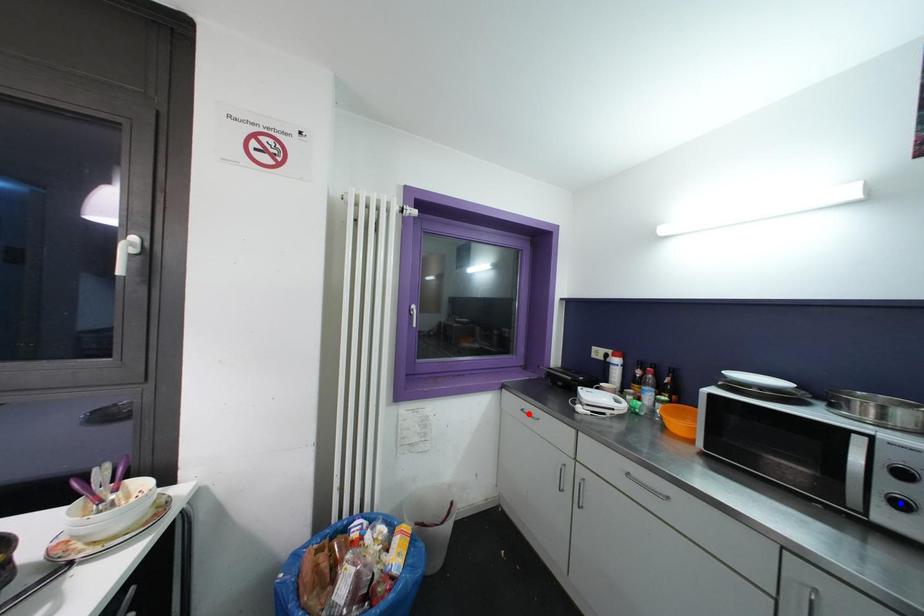
Question: Two points are marked on the image. Which point is closer to the camera?

Choices:
 (A) Blue point is closer.
 (B) Red point is closer.

Answer: (A)